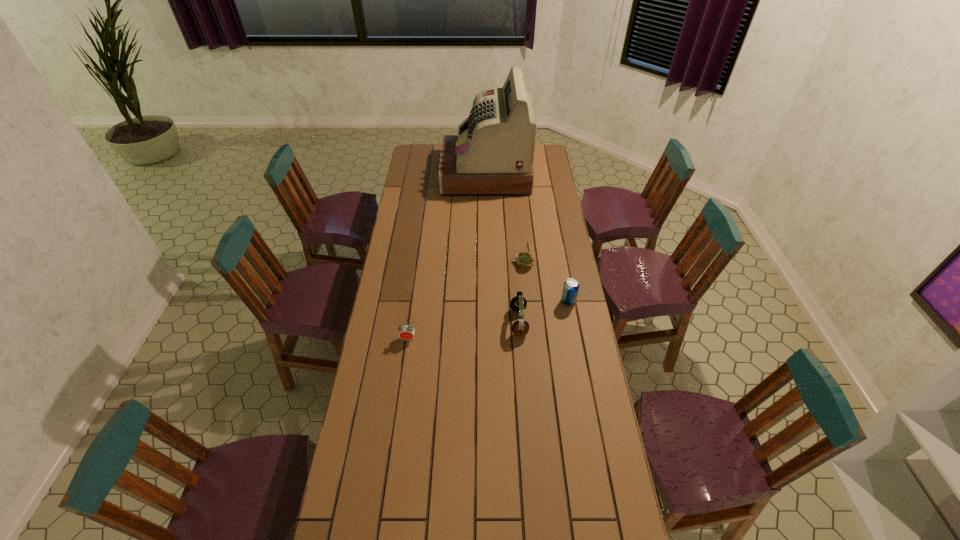
You are a GUI agent. You are given a task and a screenshot of the screen. Output one action in this format:
    pyautogui.click(x=<x>, y=<y>)
    Task: Click on the tallest object
    
    Given the screenshot: What is the action you would take?
    [492, 155]

Where is `the farthest object`? This screenshot has height=540, width=960. the farthest object is located at coordinates (492, 155).

Where is `headset`? headset is located at coordinates (518, 303).

Where is `the rightmost object`? The image size is (960, 540). the rightmost object is located at coordinates (571, 287).

Identify the location of the second farthest object. (524, 260).

Locate an element on the screen. The height and width of the screenshot is (540, 960). alarm clock is located at coordinates (406, 332).

At what (x,y) coordinates should I click in order to perform the action: click on the leftmost object. Please return your answer as a coordinate pair (x, y). Image resolution: width=960 pixels, height=540 pixels. Looking at the image, I should click on (406, 332).

I want to click on free spot located 0.050m on the operating side of the tallest object, so coord(433,174).

Identify the location of blank area located 0.110m on the operating side of the tallest object. (422, 174).

Find the location of a particular element. The width and height of the screenshot is (960, 540). free space located on the ear cups of the headset is located at coordinates (464, 322).